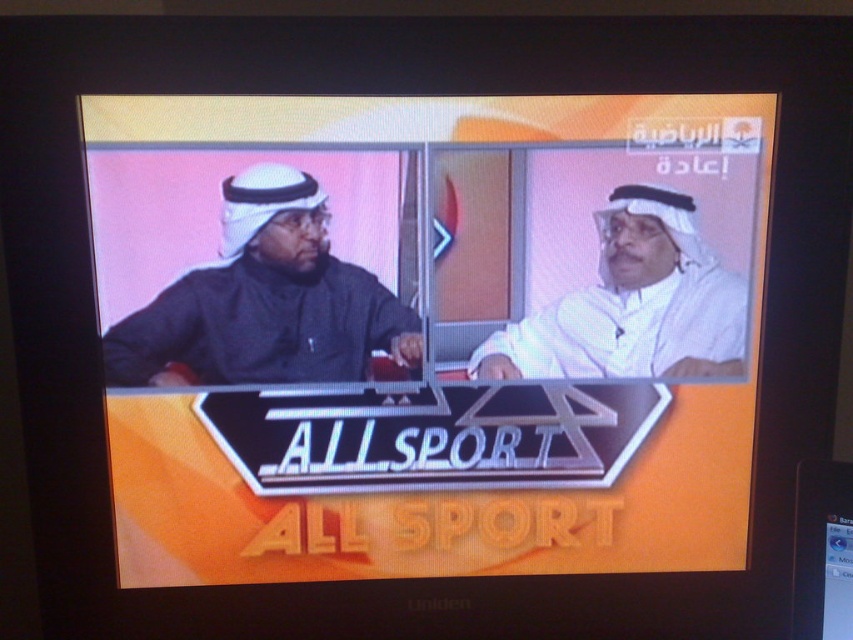
Does matte black robe at left lie behind white matte headscarf at center?

That is False.

Between matte black robe at left and white matte headscarf at center, which one has more height?

Standing taller between the two is matte black robe at left.

Is point (248, 227) farther from viewer compared to point (668, 216)?

No, it is not.

You are a GUI agent. You are given a task and a screenshot of the screen. Output one action in this format:
    pyautogui.click(x=<x>, y=<y>)
    Task: Click on the matte black robe at left
    The width and height of the screenshot is (853, 640).
    Given the screenshot: What is the action you would take?
    pyautogui.click(x=265, y=301)

Does matte black robe at left have a smaller size compared to black plastic flat at lower right?

Incorrect, matte black robe at left is not smaller in size than black plastic flat at lower right.

Is matte black robe at left shorter than black plastic flat at lower right?

No.

Is point (334, 291) positioned after point (793, 634)?

Yes, it is behind point (793, 634).

Find the location of `matte black robe at left`. matte black robe at left is located at coordinates (265, 301).

Between point (606, 330) and point (850, 589), which one is positioned behind?

The point (606, 330) is more distant.

Is white matte headscarf at center further to the viewer compared to black plastic flat at lower right?

Yes, it is behind black plastic flat at lower right.

Identify the location of white matte headscarf at center. (633, 305).

The height and width of the screenshot is (640, 853). What are the coordinates of `white matte headscarf at center` in the screenshot? It's located at (633, 305).